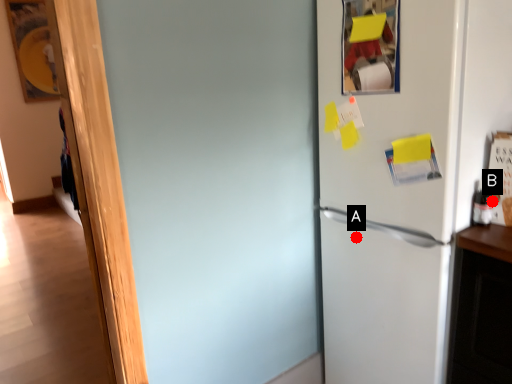
Question: Two points are circled on the image, labeled by A and B beside each circle. Which point is closer to the camera?

Choices:
 (A) A is closer
 (B) B is closer

Answer: (B)